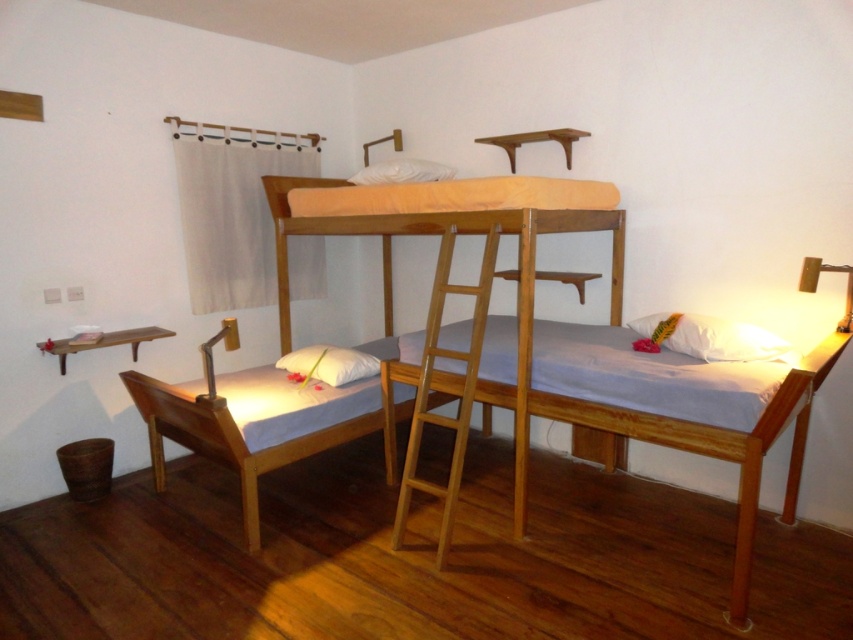
You are standing in the bedroom and want to determine the relative positions of two points marked in the image. Which point is nearer to you, point (799, 380) or point (64, 340)?

Point (799, 380) is closer to the viewer than point (64, 340).

You are a child trying to reach the white soft pillow at lower right, which is on the bed. The light brown wooden bed at center has a ladder on its side. Can you climb the ladder to get to the pillow?

The light brown wooden bed at center is in front of the white soft pillow at lower right, meaning the bed is closer to you than the pillow. Since the pillow is on the bed, you can climb the ladder on the bed to reach it.

You are a child trying to reach the wooden shelf at lower left from the white soft pillow at lower left. Can you easily reach the shelf without getting up?

The white soft pillow at lower left and wooden shelf at lower left are 33.19 inches apart, so the distance is too far to reach the shelf without getting up.